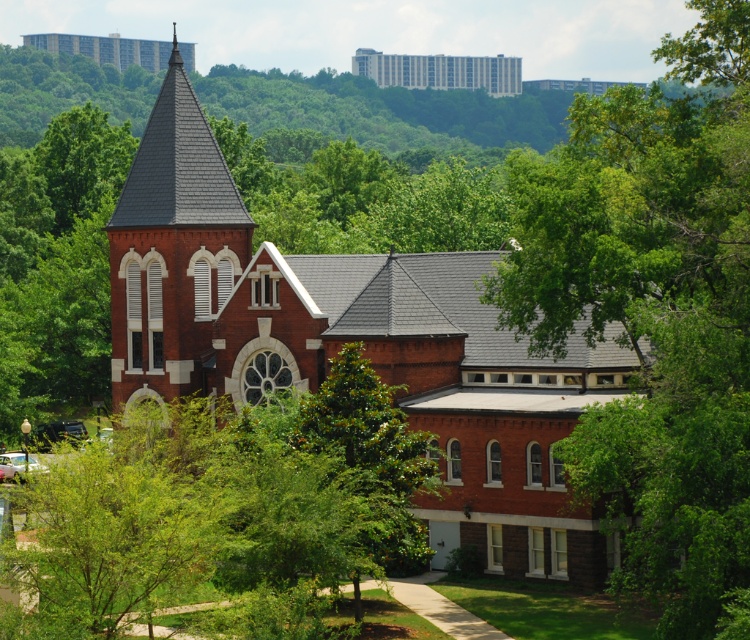
You are standing on the paved pathway leading to the church. Looking at the green leafy tree at center and the matte brick church at upper center, which object is higher in the image?

The matte brick church at upper center is higher in the image than the green leafy tree at center.

You are planning to take a photo of the brick church at upper center and the green leafy tree at center. Which object should you focus on first if you want to capture both in a single frame without moving the camera?

You should focus on the brick church at upper center first because it is wider than the green leafy tree at center, so it will occupy more space in the frame.

You are an architect analyzing the spatial relationships in the scene. Based on the image, which of the two brick churches, the brick church at center or the matte brick church at upper center, appears closer to the viewer?

The brick church at center appears closer to the viewer because it is taller than the matte brick church at upper center, indicating it is positioned in front.